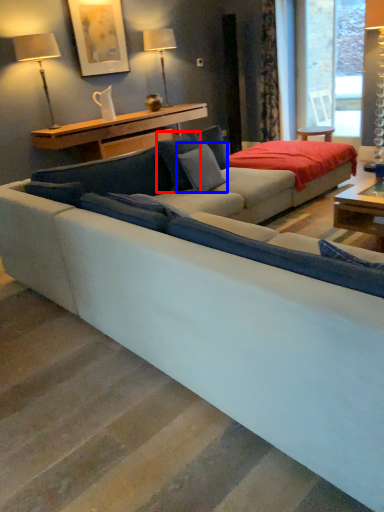
Question: Which of the following is the closest to the observer, pillow (highlighted by a red box) or pillow (highlighted by a blue box)?

Choices:
 (A) pillow
 (B) pillow

Answer: (B)